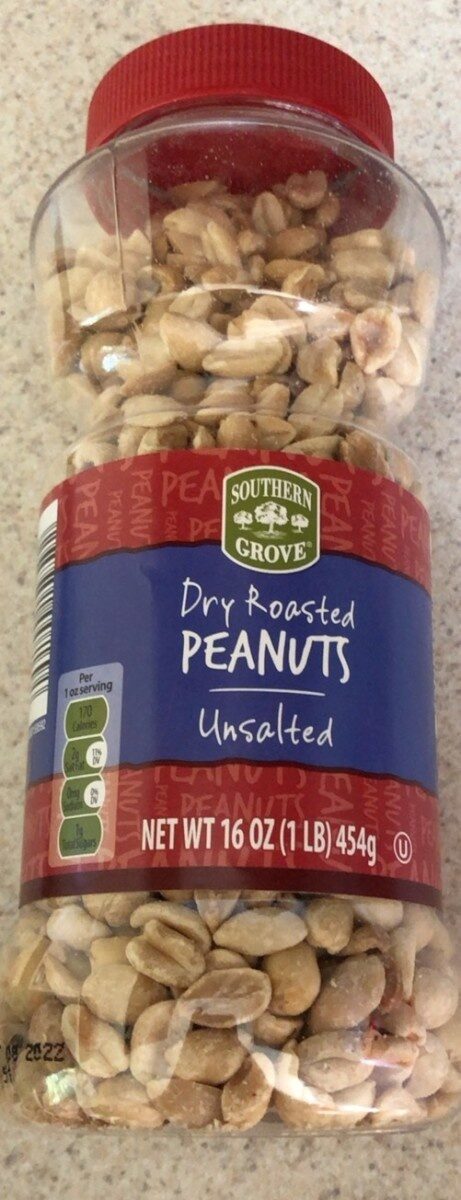
Locate an element on the screen. The image size is (461, 1200). bottle is located at coordinates (263, 253).